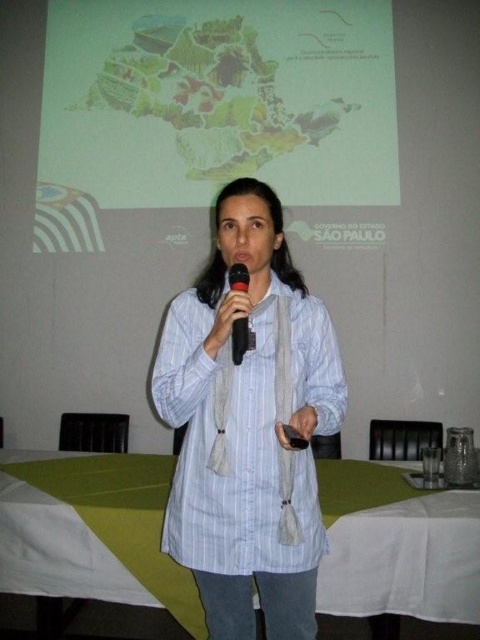
Question: Which of the following is the closest to the observer?

Choices:
 (A) 205,289
 (B) 237,340
 (C) 354,196

Answer: (B)

Question: Estimate the real-world distances between objects in this image. Which object is farther from the white striped shirt at center?

Choices:
 (A) black plastic microphone at center
 (B) matte plastic map at upper center

Answer: (B)

Question: Which object is positioned closest to the matte plastic map at upper center?

Choices:
 (A) black plastic microphone at center
 (B) white striped shirt at center

Answer: (B)

Question: Is matte plastic map at upper center closer to the viewer compared to white striped shirt at center?

Choices:
 (A) yes
 (B) no

Answer: (B)

Question: Is white striped shirt at center positioned at the back of black plastic microphone at center?

Choices:
 (A) yes
 (B) no

Answer: (A)

Question: Does white striped shirt at center appear under black plastic microphone at center?

Choices:
 (A) no
 (B) yes

Answer: (B)